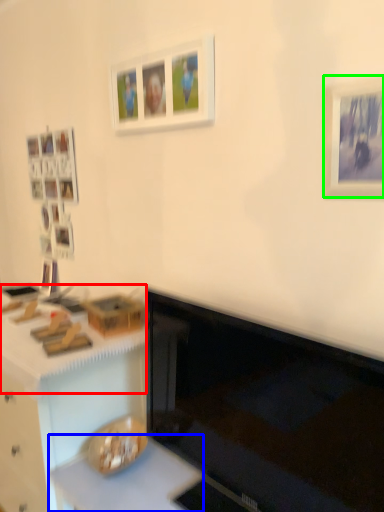
Question: Based on their relative distances, which object is farther from counter top (highlighted by a red box)? Choose from counter top (highlighted by a blue box) and picture frame (highlighted by a green box).

Choices:
 (A) counter top
 (B) picture frame

Answer: (B)